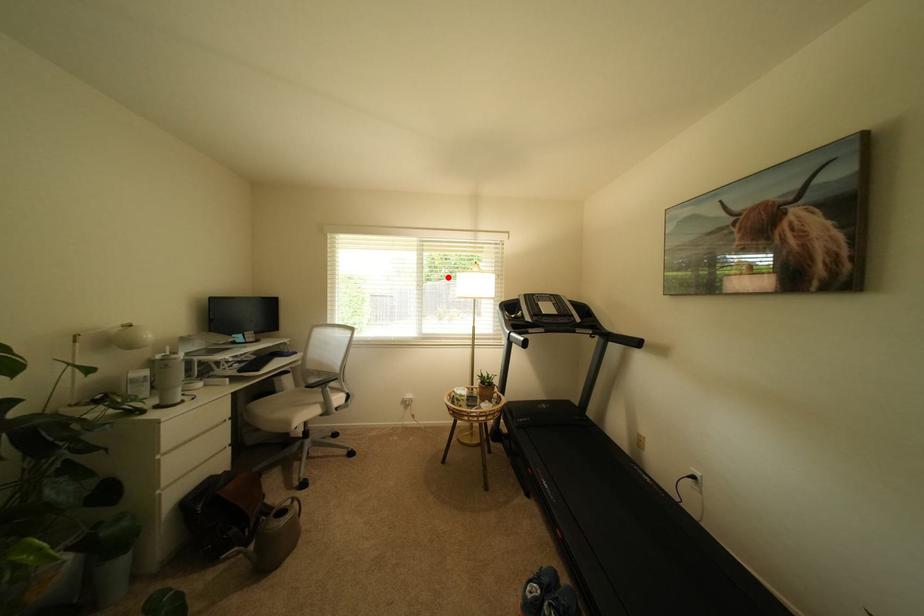
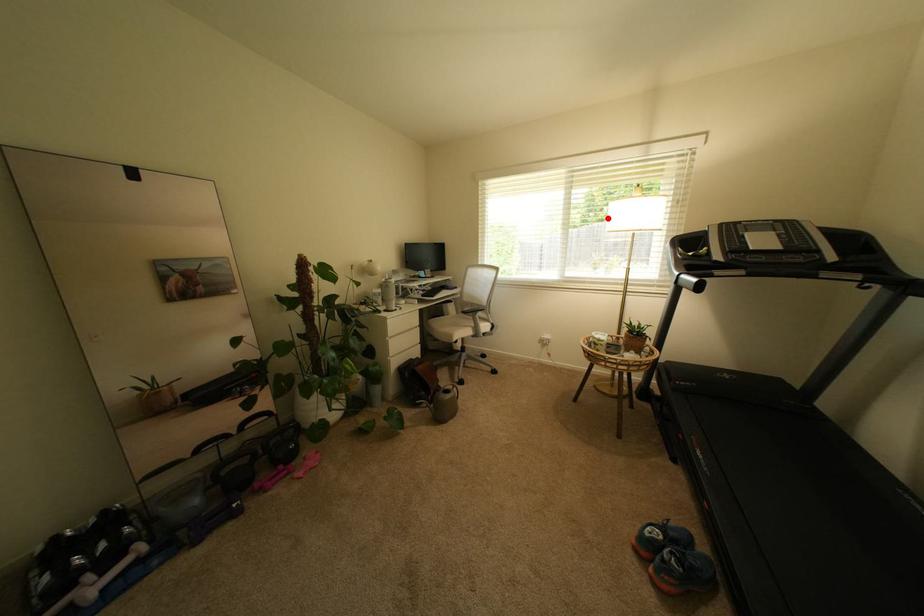
I am providing you with two images of the same scene from different viewpoints. A red point is marked on the first image and another point is marked on the second image. Is the red point in image1 aligned with the point shown in image2?

Yes